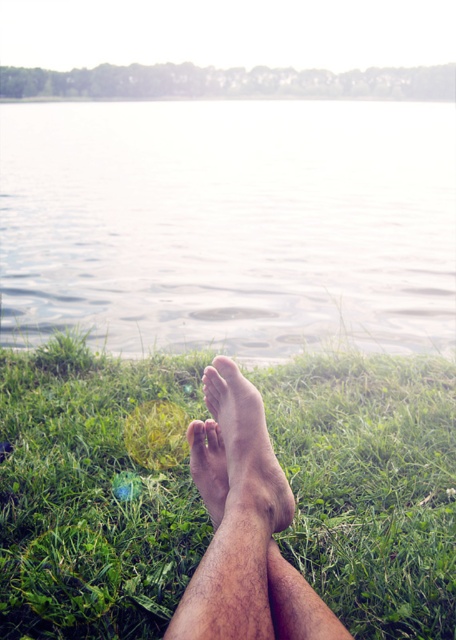
Question: Which of the following is the closest to the observer?

Choices:
 (A) (237, 460)
 (B) (187, 442)

Answer: (A)

Question: Can you confirm if clear water at center is positioned to the right of skinny barefoot at lower center?

Choices:
 (A) yes
 (B) no

Answer: (B)

Question: Does green grass at lower center lie in front of brown rough skin at lower center?

Choices:
 (A) yes
 (B) no

Answer: (B)

Question: Among these points, which one is nearest to the camera?

Choices:
 (A) (436, 540)
 (B) (294, 257)
 (C) (271, 472)
 (D) (338, 620)

Answer: (D)

Question: Is clear water at center behind brown rough skin at lower center?

Choices:
 (A) yes
 (B) no

Answer: (A)

Question: Which point appears closest to the camera in this image?

Choices:
 (A) (278, 502)
 (B) (309, 381)
 (C) (212, 628)

Answer: (C)